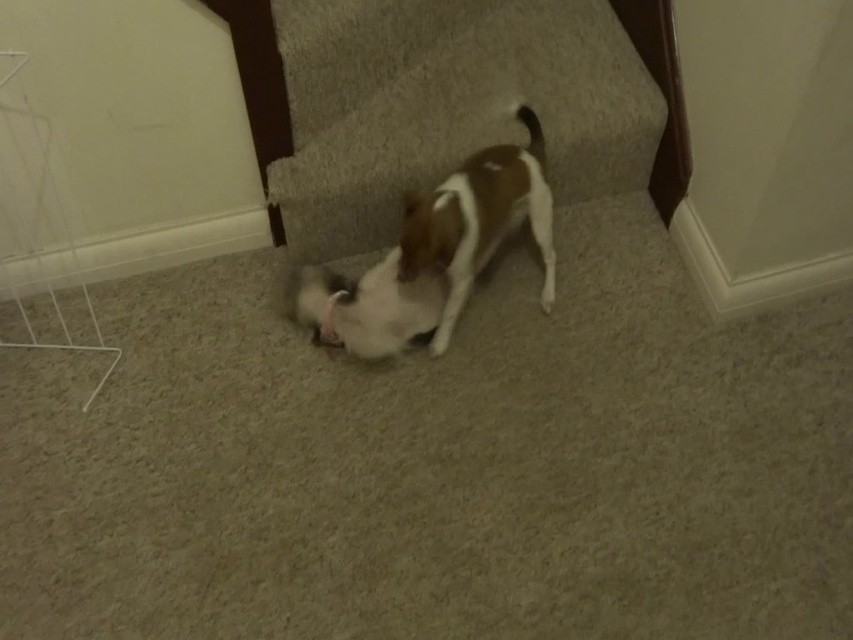
Question: Which of the following is the closest to the observer?

Choices:
 (A) (544, 259)
 (B) (389, 328)

Answer: (B)

Question: Does brown and white fur dog at center appear over white fur dog at center?

Choices:
 (A) no
 (B) yes

Answer: (B)

Question: Which object appears closest to the camera in this image?

Choices:
 (A) white fur dog at center
 (B) brown and white fur dog at center

Answer: (B)

Question: Based on their relative distances, which object is nearer to the white fur dog at center?

Choices:
 (A) carpeted stair at lower center
 (B) brown and white fur dog at center

Answer: (B)

Question: Can you confirm if carpeted stair at lower center is smaller than brown and white fur dog at center?

Choices:
 (A) no
 (B) yes

Answer: (A)

Question: Can you confirm if brown and white fur dog at center is smaller than white fur dog at center?

Choices:
 (A) no
 (B) yes

Answer: (A)